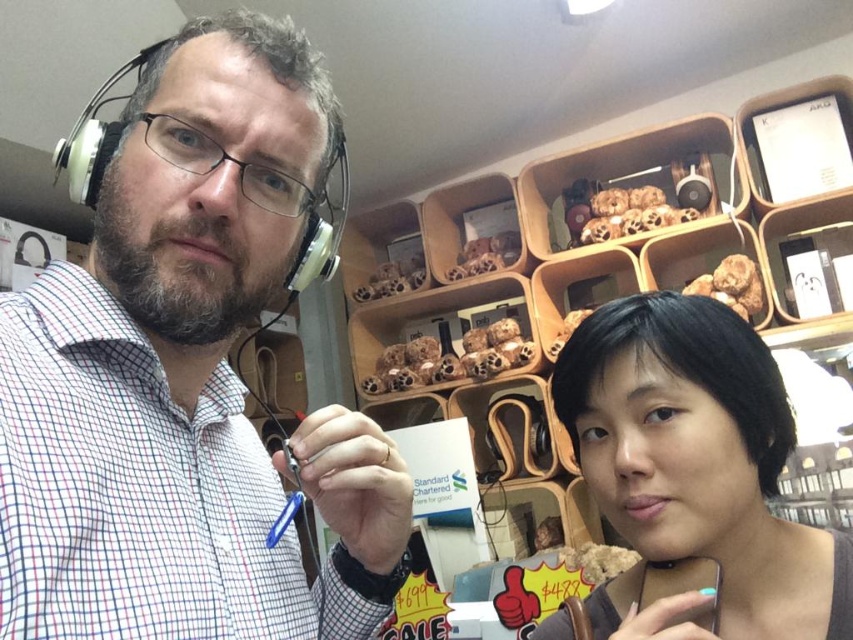
You are a store employee who needs to determine which of the two items, the white checkered shirt at left or the black matte hair at center, takes up more space in the store display. Based on their sizes, which one should you consider prioritizing for placement?

The white checkered shirt at left is bigger than the black matte hair at center, so it should be prioritized for placement as it requires more space.

You are standing in a retail shop and see the white checkered shirt at left. If you want to reach out and touch it, will your hand be able to reach it without moving closer?

The white checkered shirt at left and viewer are 15.65 inches apart, so yes, your hand can reach it without moving closer since 15.65 inches is within typical arm reach.

You are standing in the retail shop and see the point marked at coordinates [165,358]. Which object from the scene does this point lie on?

The point at coordinates [165,358] lies on the white checkered shirt at left.